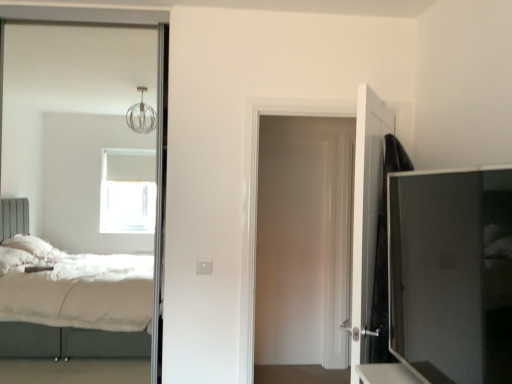
What do you see at coordinates (451, 274) in the screenshot? The image size is (512, 384). I see `matte black tv cabinet at right` at bounding box center [451, 274].

At what (x,y) coordinates should I click in order to perform the action: click on matte black tv cabinet at right. Please return your answer as a coordinate pair (x, y). The image size is (512, 384). Looking at the image, I should click on (451, 274).

Locate an element on the screen. The height and width of the screenshot is (384, 512). white glossy door at center, positioned as the 2th door in front-to-back order is located at coordinates (256, 203).

Image resolution: width=512 pixels, height=384 pixels. Find the location of `black matte door at right, marked as the 2th door in a back-to-front arrangement`. black matte door at right, marked as the 2th door in a back-to-front arrangement is located at coordinates (366, 217).

From the image's perspective, between matte black tv cabinet at right and black matte door at right, which ranks as the 1th door in front-to-back order, who is located below?

black matte door at right, which ranks as the 1th door in front-to-back order, from the image's perspective.

Which of these two, matte black tv cabinet at right or black matte door at right, marked as the 2th door in a back-to-front arrangement, is thinner?

matte black tv cabinet at right.

Is matte black tv cabinet at right closer to camera compared to black matte door at right, which ranks as the 1th door in front-to-back order?

Yes, it is.

From a real-world perspective, who is located higher, matte black tv cabinet at right or black matte door at right, marked as the 2th door in a back-to-front arrangement?

matte black tv cabinet at right.

Between white glossy door at center, which is counted as the first door, starting from the back, and matte black tv cabinet at right, which one appears on the right side from the viewer's perspective?

matte black tv cabinet at right.

Could you measure the distance between white glossy door at center, positioned as the 2th door in front-to-back order, and matte black tv cabinet at right?

white glossy door at center, positioned as the 2th door in front-to-back order, is 3.87 feet from matte black tv cabinet at right.

Are white glossy door at center, positioned as the 2th door in front-to-back order, and matte black tv cabinet at right far apart?

Yes, white glossy door at center, positioned as the 2th door in front-to-back order, and matte black tv cabinet at right are quite far apart.

From a real-world perspective, is black matte door at right, which ranks as the 1th door in front-to-back order, beneath white glossy door at center, positioned as the 2th door in front-to-back order?

Yes, from a real-world perspective, black matte door at right, which ranks as the 1th door in front-to-back order, is below white glossy door at center, positioned as the 2th door in front-to-back order.

Considering the sizes of black matte door at right, marked as the 2th door in a back-to-front arrangement, and white glossy door at center, which is counted as the first door, starting from the back, in the image, is black matte door at right, marked as the 2th door in a back-to-front arrangement, taller or shorter than white glossy door at center, which is counted as the first door, starting from the back,?

In the image, black matte door at right, marked as the 2th door in a back-to-front arrangement, appears to be shorter than white glossy door at center, which is counted as the first door, starting from the back.

Does black matte door at right, which ranks as the 1th door in front-to-back order, turn towards white glossy door at center, which is counted as the first door, starting from the back?

Yes, black matte door at right, which ranks as the 1th door in front-to-back order, is facing white glossy door at center, which is counted as the first door, starting from the back.

Does black matte door at right, marked as the 2th door in a back-to-front arrangement, appear on the left side of white glossy door at center, positioned as the 2th door in front-to-back order?

In fact, black matte door at right, marked as the 2th door in a back-to-front arrangement, is to the right of white glossy door at center, positioned as the 2th door in front-to-back order.

Is black matte door at right, marked as the 2th door in a back-to-front arrangement, at the right side of matte black tv cabinet at right?

Yes, black matte door at right, marked as the 2th door in a back-to-front arrangement, is to the right of matte black tv cabinet at right.

What's the angular difference between black matte door at right, which ranks as the 1th door in front-to-back order, and matte black tv cabinet at right's facing directions?

They differ by 31.6 degrees in their facing directions.

Based on the photo, between black matte door at right, which ranks as the 1th door in front-to-back order, and matte black tv cabinet at right, which one has smaller width?

matte black tv cabinet at right is thinner.

Is matte black tv cabinet at right not close to white glossy door at center, which is counted as the first door, starting from the back?

matte black tv cabinet at right is positioned a significant distance from white glossy door at center, which is counted as the first door, starting from the back.

Where is `tv cabinet above the white glossy door at center, which is counted as the first door, starting from the back (from a real-world perspective)`? The width and height of the screenshot is (512, 384). tv cabinet above the white glossy door at center, which is counted as the first door, starting from the back (from a real-world perspective) is located at coordinates (451, 274).

Between matte black tv cabinet at right and white glossy door at center, positioned as the 2th door in front-to-back order, which one is positioned behind?

white glossy door at center, positioned as the 2th door in front-to-back order, is behind.

Which of these two, matte black tv cabinet at right or white glossy door at center, which is counted as the first door, starting from the back, is smaller?

With smaller size is matte black tv cabinet at right.

Is white glossy door at center, positioned as the 2th door in front-to-back order, further to camera compared to black matte door at right, which ranks as the 1th door in front-to-back order?

That is True.

Which is closer to the camera, (x=264, y=105) or (x=382, y=186)?

Point (x=264, y=105) appears to be farther away from the viewer than point (x=382, y=186).

Would you consider white glossy door at center, which is counted as the first door, starting from the back, to be distant from black matte door at right, which ranks as the 1th door in front-to-back order?

No, white glossy door at center, which is counted as the first door, starting from the back, is not far from black matte door at right, which ranks as the 1th door in front-to-back order.

From a real-world perspective, is white glossy door at center, which is counted as the first door, starting from the back, positioned above or below black matte door at right, marked as the 2th door in a back-to-front arrangement?

white glossy door at center, which is counted as the first door, starting from the back, is above black matte door at right, marked as the 2th door in a back-to-front arrangement.

The width and height of the screenshot is (512, 384). Find the location of `tv cabinet that appears in front of the black matte door at right, which ranks as the 1th door in front-to-back order`. tv cabinet that appears in front of the black matte door at right, which ranks as the 1th door in front-to-back order is located at coordinates (451, 274).

Find the location of `tv cabinet that appears on the right of white glossy door at center, positioned as the 2th door in front-to-back order`. tv cabinet that appears on the right of white glossy door at center, positioned as the 2th door in front-to-back order is located at coordinates (451, 274).

Considering their positions, is matte black tv cabinet at right positioned further to black matte door at right, marked as the 2th door in a back-to-front arrangement, than white glossy door at center, which is counted as the first door, starting from the back?

Among the two, white glossy door at center, which is counted as the first door, starting from the back, is located further to black matte door at right, marked as the 2th door in a back-to-front arrangement.

When comparing their distances from white glossy door at center, positioned as the 2th door in front-to-back order, does matte black tv cabinet at right or black matte door at right, marked as the 2th door in a back-to-front arrangement, seem closer?

black matte door at right, marked as the 2th door in a back-to-front arrangement, lies closer to white glossy door at center, positioned as the 2th door in front-to-back order, than the other object.

Which object lies further to the anchor point black matte door at right, which ranks as the 1th door in front-to-back order, white glossy door at center, positioned as the 2th door in front-to-back order, or matte black tv cabinet at right?

white glossy door at center, positioned as the 2th door in front-to-back order, is further to black matte door at right, which ranks as the 1th door in front-to-back order.

In the scene shown: Estimate the real-world distances between objects in this image. Which object is further from matte black tv cabinet at right, black matte door at right, which ranks as the 1th door in front-to-back order, or white glossy door at center, positioned as the 2th door in front-to-back order?

Among the two, white glossy door at center, positioned as the 2th door in front-to-back order, is located further to matte black tv cabinet at right.

Considering their positions, is white glossy door at center, which is counted as the first door, starting from the back, positioned further to matte black tv cabinet at right than black matte door at right, marked as the 2th door in a back-to-front arrangement?

Based on the image, white glossy door at center, which is counted as the first door, starting from the back, appears to be further to matte black tv cabinet at right.

Considering their positions, is black matte door at right, which ranks as the 1th door in front-to-back order, positioned closer to white glossy door at center, positioned as the 2th door in front-to-back order, than matte black tv cabinet at right?

Among the two, black matte door at right, which ranks as the 1th door in front-to-back order, is located nearer to white glossy door at center, positioned as the 2th door in front-to-back order.

Identify the location of door between matte black tv cabinet at right and white glossy door at center, which is counted as the first door, starting from the back, from front to back. Image resolution: width=512 pixels, height=384 pixels. (366, 217).